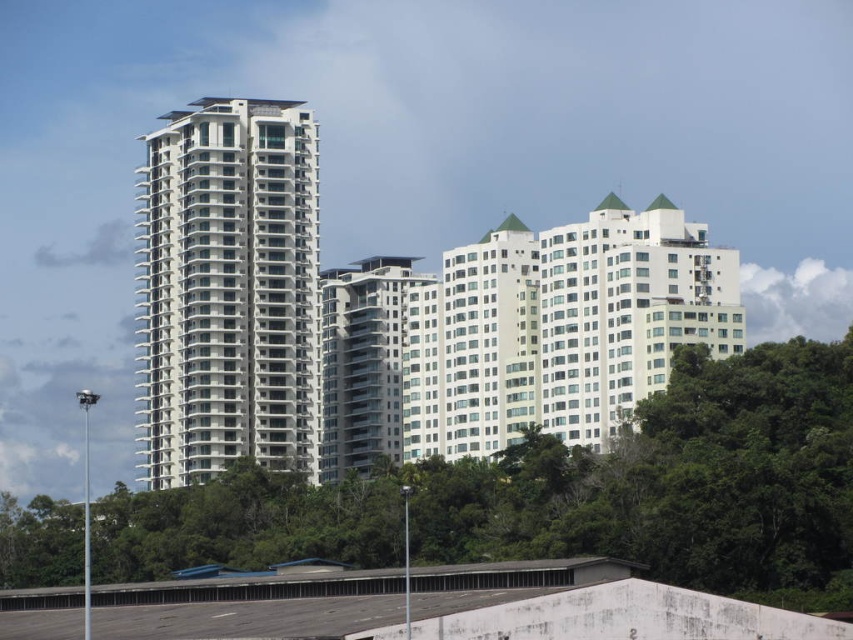
Between green leafy tree at center and white smooth building at left, which one is positioned lower?

green leafy tree at center is lower down.

Is green leafy tree at center positioned before white smooth building at left?

Yes.

Is point (746, 566) behind point (314, 432)?

No, it is not.

Where is `green leafy tree at center`? green leafy tree at center is located at coordinates (566, 493).

Looking at this image, measure the distance between white smooth building at left and white glass building at center.

white smooth building at left and white glass building at center are 17.55 meters apart from each other.

Which is in front, point (286, 314) or point (428, 280)?

Point (286, 314) is more forward.

This screenshot has height=640, width=853. I want to click on white smooth building at left, so click(227, 291).

Does green leafy tree at center appear under white glass building at center?

Yes.

Does green leafy tree at center appear on the left side of white glass building at center?

No, green leafy tree at center is not to the left of white glass building at center.

Is point (712, 481) less distant than point (398, 451)?

That is True.

Identify the location of green leafy tree at center. The image size is (853, 640). (566, 493).